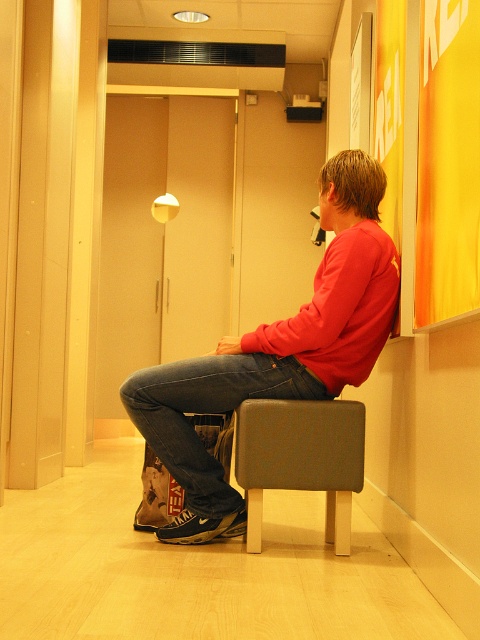
Looking at this image, you are a fashion designer observing a person dressed in a red matte sweater at center and denim at center. Which item of clothing appears bigger on the person?

The red matte sweater at center has a larger size compared to denim at center, so it appears bigger on the person.